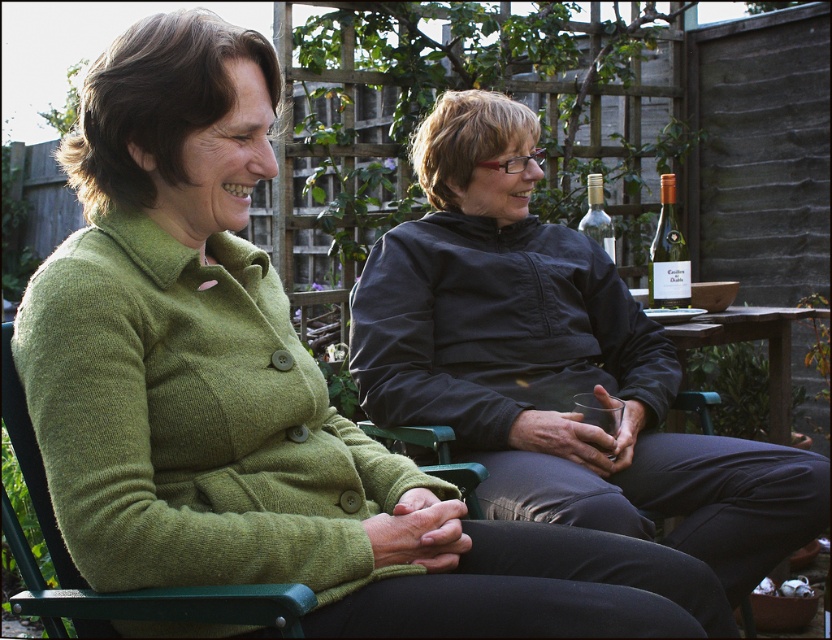
You are a photographer planning to take a portrait of the two people in the garden. You notice the matte black jacket at center and the translucent glass wine bottle at right. Which object is closer to the camera, based on their positions?

The matte black jacket at center is positioned under the translucent glass wine bottle at right, meaning the wine bottle is closer to the camera since it is above the jacket in the scene.

You are designing a layout for a magazine cover and need to place two elements based on their sizes. The matte black jacket at center and the clear glass bottle at upper right are the elements. Which element should you place first if you want to prioritize the larger object?

The matte black jacket at center should be placed first because its width surpasses the clear glass bottle at upper right, making it the larger object.

You are a guest at a garden party and need to grab a drink. You see a translucent glass wine bottle at right and a clear glass bottle at upper right. Which bottle is positioned lower in the image?

The translucent glass wine bottle at right is positioned lower than the clear glass bottle at upper right.